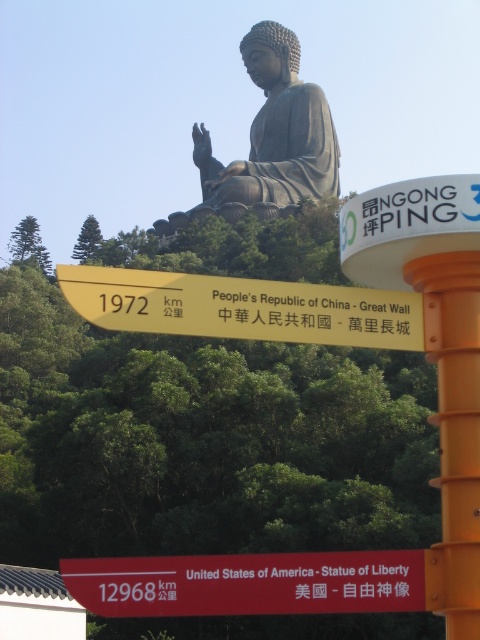
Does red plastic sign at lower center appear over orange plastic pole at right?

Actually, red plastic sign at lower center is below orange plastic pole at right.

What do you see at coordinates (249, 582) in the screenshot?
I see `red plastic sign at lower center` at bounding box center [249, 582].

You are a GUI agent. You are given a task and a screenshot of the screen. Output one action in this format:
    pyautogui.click(x=<x>, y=<y>)
    Task: Click on the red plastic sign at lower center
    Image resolution: width=480 pixels, height=640 pixels.
    Given the screenshot: What is the action you would take?
    pyautogui.click(x=249, y=582)

Can you confirm if bronze statue at upper center is thinner than orange plastic pole at right?

In fact, bronze statue at upper center might be wider than orange plastic pole at right.

Which is below, bronze statue at upper center or orange plastic pole at right?

orange plastic pole at right is below.

Which is behind, point (204, 154) or point (446, 292)?

The point (204, 154) is more distant.

The image size is (480, 640). I want to click on bronze statue at upper center, so click(268, 140).

Who is shorter, red plastic sign at lower center or bronze statue at upper center?

red plastic sign at lower center

Where is `red plastic sign at lower center`? The image size is (480, 640). red plastic sign at lower center is located at coordinates (249, 582).